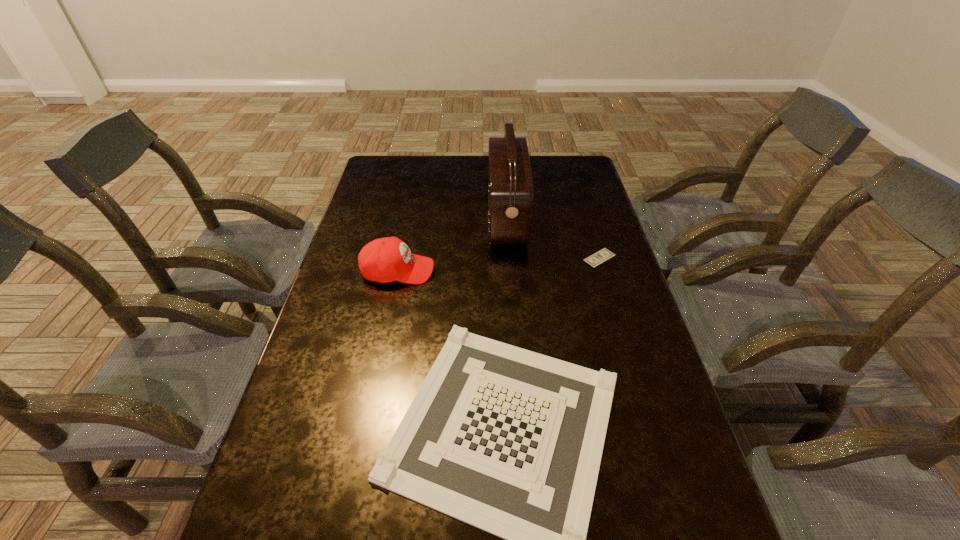
Identify the location of radio receiver. (510, 182).

The width and height of the screenshot is (960, 540). I want to click on the second tallest object, so click(x=388, y=259).

Where is `money`? The image size is (960, 540). money is located at coordinates (601, 256).

This screenshot has width=960, height=540. I want to click on free location located on the front panel of the radio receiver, so click(x=450, y=219).

The width and height of the screenshot is (960, 540). I want to click on blank space located 0.060m on the front panel of the radio receiver, so click(x=470, y=219).

What are the coordinates of `vacant space located 0.110m on the front panel of the radio receiver` in the screenshot? It's located at (456, 219).

Identify the location of vacant space situated on the front panel of the second tallest object. The width and height of the screenshot is (960, 540). pyautogui.click(x=547, y=271).

Identify the location of free space located 0.170m on the back of the money. (588, 217).

The image size is (960, 540). I want to click on object located at the left edge, so (388, 259).

Where is `object at the right edge`? The height and width of the screenshot is (540, 960). object at the right edge is located at coordinates (601, 256).